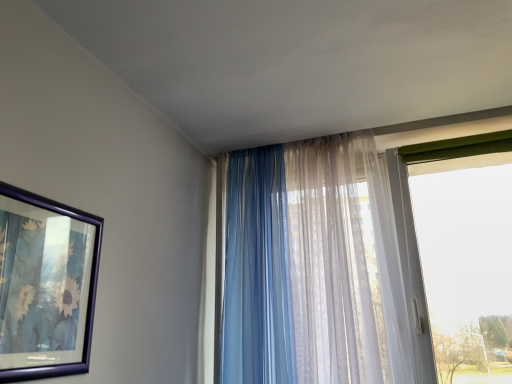
Question: From the image's perspective, would you say metallic blue picture frame at left is shown under translucent sheer curtain at right, which is the second curtain in left-to-right order?

Choices:
 (A) yes
 (B) no

Answer: (B)

Question: Are metallic blue picture frame at left and translucent sheer curtain at right, the 1th curtain viewed from the right, beside each other?

Choices:
 (A) yes
 (B) no

Answer: (B)

Question: Is metallic blue picture frame at left turned away from translucent sheer curtain at right, which is the second curtain in left-to-right order?

Choices:
 (A) yes
 (B) no

Answer: (B)

Question: Can you confirm if metallic blue picture frame at left is smaller than translucent sheer curtain at right, which is the second curtain in left-to-right order?

Choices:
 (A) yes
 (B) no

Answer: (A)

Question: From a real-world perspective, is metallic blue picture frame at left positioned over translucent sheer curtain at right, the 1th curtain viewed from the right, based on gravity?

Choices:
 (A) no
 (B) yes

Answer: (A)

Question: Is metallic blue picture frame at left inside or outside of translucent fabric curtain at center, which ranks as the second curtain in right-to-left order?

Choices:
 (A) inside
 (B) outside

Answer: (B)

Question: Considering the positions of metallic blue picture frame at left and translucent fabric curtain at center, which ranks as the second curtain in right-to-left order, in the image, is metallic blue picture frame at left bigger or smaller than translucent fabric curtain at center, which ranks as the second curtain in right-to-left order,?

Choices:
 (A) big
 (B) small

Answer: (B)

Question: Based on their positions, is metallic blue picture frame at left located to the left or right of translucent fabric curtain at center, which ranks as the second curtain in right-to-left order?

Choices:
 (A) right
 (B) left

Answer: (B)

Question: Is point (69, 251) positioned closer to the camera than point (256, 324)?

Choices:
 (A) closer
 (B) farther

Answer: (A)

Question: Choose the correct answer: Is translucent fabric curtain at center, the first curtain when ordered from left to right, inside metallic blue picture frame at left or outside it?

Choices:
 (A) inside
 (B) outside

Answer: (B)

Question: From a real-world perspective, is translucent fabric curtain at center, the first curtain when ordered from left to right, above or below metallic blue picture frame at left?

Choices:
 (A) above
 (B) below

Answer: (A)

Question: Relative to metallic blue picture frame at left, is translucent fabric curtain at center, which ranks as the second curtain in right-to-left order, in front or behind?

Choices:
 (A) front
 (B) behind

Answer: (B)

Question: Is translucent fabric curtain at center, the first curtain when ordered from left to right, taller or shorter than metallic blue picture frame at left?

Choices:
 (A) tall
 (B) short

Answer: (A)

Question: From the image's perspective, is metallic blue picture frame at left positioned above or below translucent sheer curtain at right, the 1th curtain viewed from the right?

Choices:
 (A) below
 (B) above

Answer: (B)

Question: Is metallic blue picture frame at left inside or outside of translucent sheer curtain at right, the 1th curtain viewed from the right?

Choices:
 (A) inside
 (B) outside

Answer: (B)